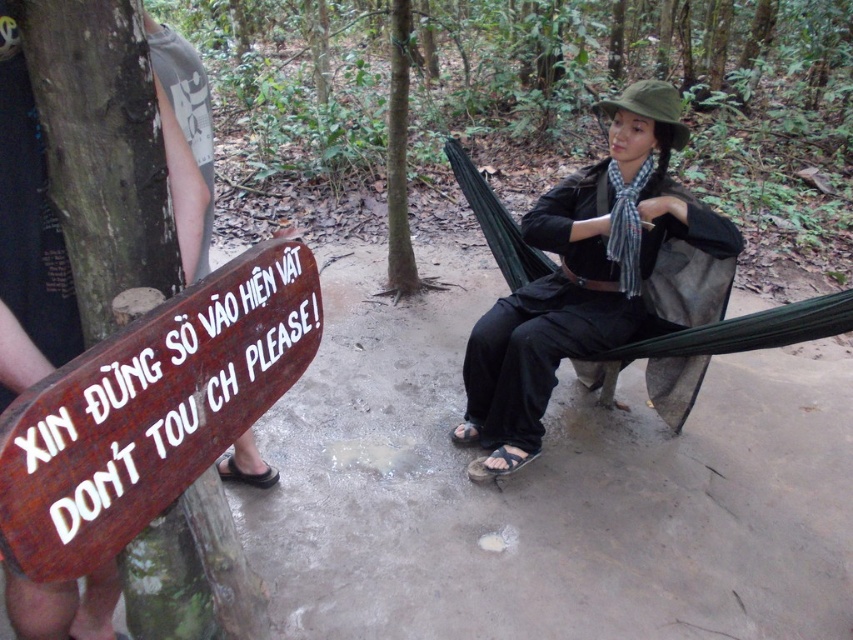
Question: Which of the following is the farthest from the observer?

Choices:
 (A) matte black outfit at center
 (B) wooden sign at left
 (C) green rough bark tree at center
 (D) brown leather sandal at lower left

Answer: (C)

Question: Does matte black outfit at center have a smaller size compared to brown leather sandal at lower left?

Choices:
 (A) yes
 (B) no

Answer: (B)

Question: Considering the real-world distances, which object is closest to the wooden sign at left?

Choices:
 (A) green rough bark tree at center
 (B) brown leather sandal at lower left
 (C) matte black outfit at center

Answer: (B)

Question: Does green rough bark tree at center have a greater width compared to brown leather sandal at lower left?

Choices:
 (A) yes
 (B) no

Answer: (A)

Question: Can you confirm if wooden sign at left is thinner than green rough bark tree at center?

Choices:
 (A) yes
 (B) no

Answer: (A)

Question: Which is farther from the brown leather sandal at lower left?

Choices:
 (A) green rough bark tree at center
 (B) matte black outfit at center

Answer: (A)